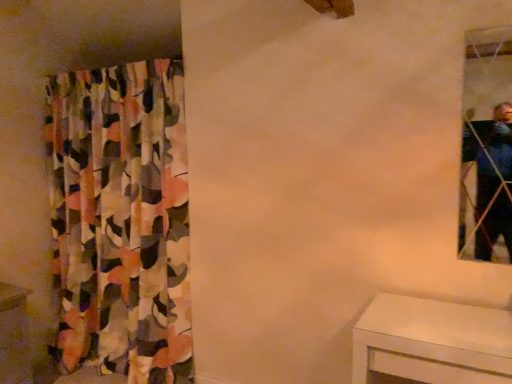
Question: Can you confirm if clear glass mirror at upper right is bigger than multicolored fabric curtain at left?

Choices:
 (A) yes
 (B) no

Answer: (B)

Question: Considering the relative sizes of clear glass mirror at upper right and multicolored fabric curtain at left in the image provided, is clear glass mirror at upper right thinner than multicolored fabric curtain at left?

Choices:
 (A) yes
 (B) no

Answer: (A)

Question: Is clear glass mirror at upper right aimed at multicolored fabric curtain at left?

Choices:
 (A) yes
 (B) no

Answer: (B)

Question: Considering the relative positions of clear glass mirror at upper right and multicolored fabric curtain at left in the image provided, is clear glass mirror at upper right in front of multicolored fabric curtain at left?

Choices:
 (A) yes
 (B) no

Answer: (A)

Question: From the image's perspective, does clear glass mirror at upper right appear higher than multicolored fabric curtain at left?

Choices:
 (A) no
 (B) yes

Answer: (B)

Question: Would you say clear glass mirror at upper right is to the left or to the right of white glossy vanity at lower left in the picture?

Choices:
 (A) right
 (B) left

Answer: (A)

Question: Is clear glass mirror at upper right situated inside white glossy vanity at lower left or outside?

Choices:
 (A) inside
 (B) outside

Answer: (B)

Question: From the image's perspective, relative to white glossy vanity at lower left, is clear glass mirror at upper right above or below?

Choices:
 (A) below
 (B) above

Answer: (B)

Question: From a real-world perspective, is clear glass mirror at upper right above or below white glossy vanity at lower left?

Choices:
 (A) below
 (B) above

Answer: (B)

Question: Visually, is white glossy vanity at lower left positioned to the left or to the right of multicolored fabric curtain at left?

Choices:
 (A) left
 (B) right

Answer: (A)

Question: In terms of size, does white glossy vanity at lower left appear bigger or smaller than multicolored fabric curtain at left?

Choices:
 (A) big
 (B) small

Answer: (B)

Question: Does point (0, 317) appear closer or farther from the camera than point (93, 208)?

Choices:
 (A) closer
 (B) farther

Answer: (A)

Question: Is white glossy vanity at lower left in front of or behind multicolored fabric curtain at left in the image?

Choices:
 (A) behind
 (B) front

Answer: (A)

Question: Is white glossy vanity at lower left wider or thinner than clear glass mirror at upper right?

Choices:
 (A) wide
 (B) thin

Answer: (A)

Question: Considering the relative positions of white glossy vanity at lower left and clear glass mirror at upper right in the image provided, is white glossy vanity at lower left to the left or to the right of clear glass mirror at upper right?

Choices:
 (A) right
 (B) left

Answer: (B)